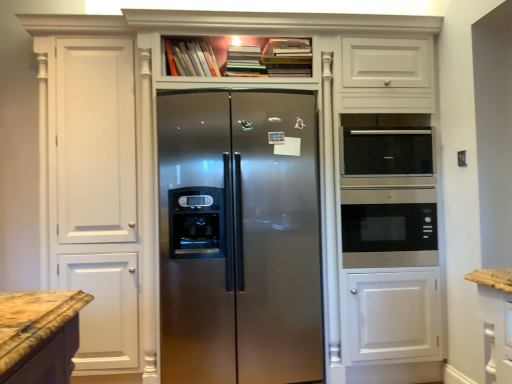
Question: Is hardcover book at upper center, which is counted as the 3th book, starting from the right, smaller than black glass microwave at right?

Choices:
 (A) no
 (B) yes

Answer: (B)

Question: Is hardcover book at upper center, which is counted as the 3th book, starting from the right, at the left side of black glass microwave at right?

Choices:
 (A) yes
 (B) no

Answer: (A)

Question: Does hardcover book at upper center, acting as the first book starting from the left, have a lesser width compared to black glass microwave at right?

Choices:
 (A) no
 (B) yes

Answer: (B)

Question: From a real-world perspective, is hardcover book at upper center, which is counted as the 3th book, starting from the right, located higher than black glass microwave at right?

Choices:
 (A) yes
 (B) no

Answer: (A)

Question: From a real-world perspective, is hardcover book at upper center, which is counted as the 3th book, starting from the right, beneath black glass microwave at right?

Choices:
 (A) yes
 (B) no

Answer: (B)

Question: Considering the positions of black glass microwave at upper right and hardcover books at upper center, which ranks as the first book in right-to-left order, in the image, is black glass microwave at upper right wider or thinner than hardcover books at upper center, which ranks as the first book in right-to-left order,?

Choices:
 (A) wide
 (B) thin

Answer: (B)

Question: From a real-world perspective, relative to hardcover books at upper center, which ranks as the first book in right-to-left order, is black glass microwave at upper right vertically above or below?

Choices:
 (A) above
 (B) below

Answer: (B)

Question: Would you say black glass microwave at upper right is to the left or to the right of hardcover books at upper center, which ranks as the first book in right-to-left order, in the picture?

Choices:
 (A) left
 (B) right

Answer: (B)

Question: Which is correct: black glass microwave at upper right is inside hardcover books at upper center, which ranks as the first book in right-to-left order, or outside of it?

Choices:
 (A) outside
 (B) inside

Answer: (A)

Question: From the image's perspective, is hardcover books at upper center, which ranks as the first book in right-to-left order, above or below hardcover book at upper center, acting as the first book starting from the left?

Choices:
 (A) below
 (B) above

Answer: (B)

Question: Considering the positions of hardcover books at upper center, which ranks as the first book in right-to-left order, and hardcover book at upper center, which is counted as the 3th book, starting from the right, in the image, is hardcover books at upper center, which ranks as the first book in right-to-left order, taller or shorter than hardcover book at upper center, which is counted as the 3th book, starting from the right,?

Choices:
 (A) tall
 (B) short

Answer: (A)

Question: Looking at their shapes, would you say hardcover books at upper center, which ranks as the first book in right-to-left order, is wider or thinner than hardcover book at upper center, acting as the first book starting from the left?

Choices:
 (A) wide
 (B) thin

Answer: (A)

Question: Is hardcover books at upper center, which ranks as the first book in right-to-left order, situated inside hardcover book at upper center, which is counted as the 3th book, starting from the right, or outside?

Choices:
 (A) inside
 (B) outside

Answer: (B)

Question: Is hardcover books at upper center, which is the 2th book from right to left, in front of or behind hardcover book at upper center, which is counted as the 3th book, starting from the right, in the image?

Choices:
 (A) front
 (B) behind

Answer: (A)

Question: Do you think hardcover books at upper center, which is the 2th book from right to left, is within hardcover book at upper center, which is counted as the 3th book, starting from the right, or outside of it?

Choices:
 (A) outside
 (B) inside

Answer: (A)